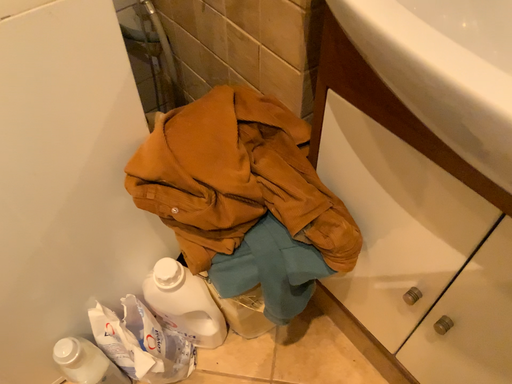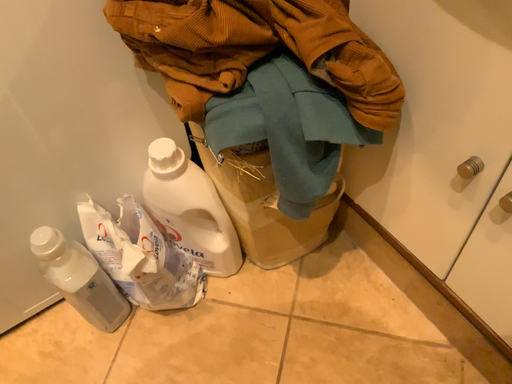
Question: How did the camera likely rotate when shooting the video?

Choices:
 (A) rotated left
 (B) rotated right

Answer: (A)